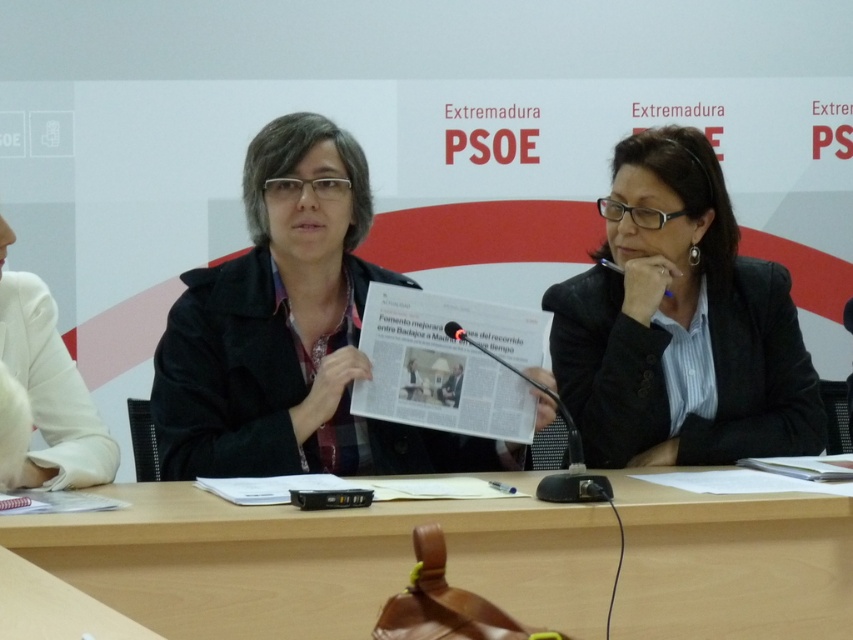
What are the coordinates of `wooden table at center` in the screenshot? It's located at click(317, 561).

Is point (596, 513) more distant than point (675, 369)?

No, (596, 513) is closer to viewer.

Where is `wooden table at center`? wooden table at center is located at coordinates (317, 561).

Is wooden table at center further to camera compared to matte black coat at center?

No, it is not.

What do you see at coordinates (317, 561) in the screenshot? The width and height of the screenshot is (853, 640). I see `wooden table at center` at bounding box center [317, 561].

Locate an element on the screen. wooden table at center is located at coordinates (317, 561).

Is matte black coat at center above white fabric sleeve at left?

Yes, matte black coat at center is above white fabric sleeve at left.

Based on the photo, who is more distant from viewer, [236,435] or [83,420]?

Positioned behind is point [236,435].

In order to click on matte black coat at center in this screenshot , I will do `click(289, 333)`.